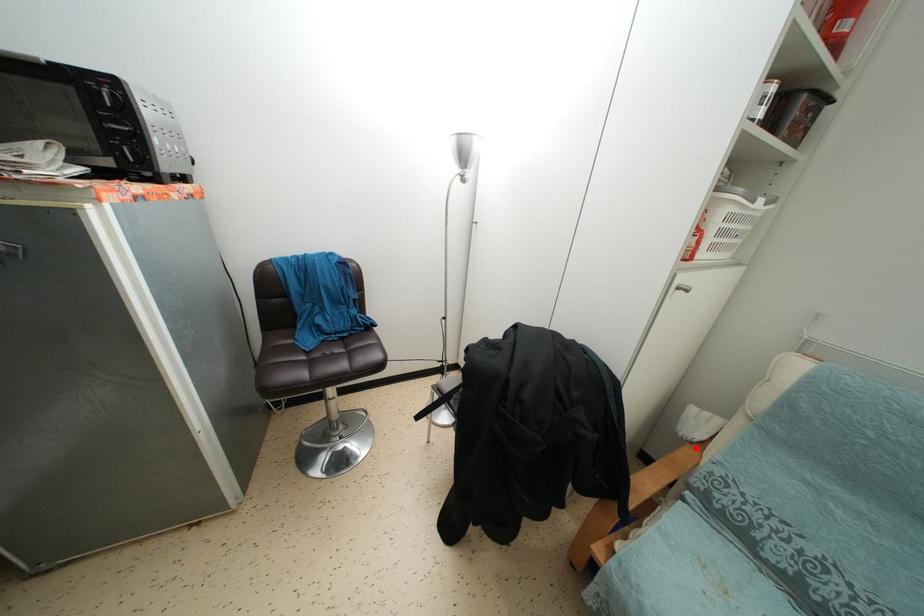
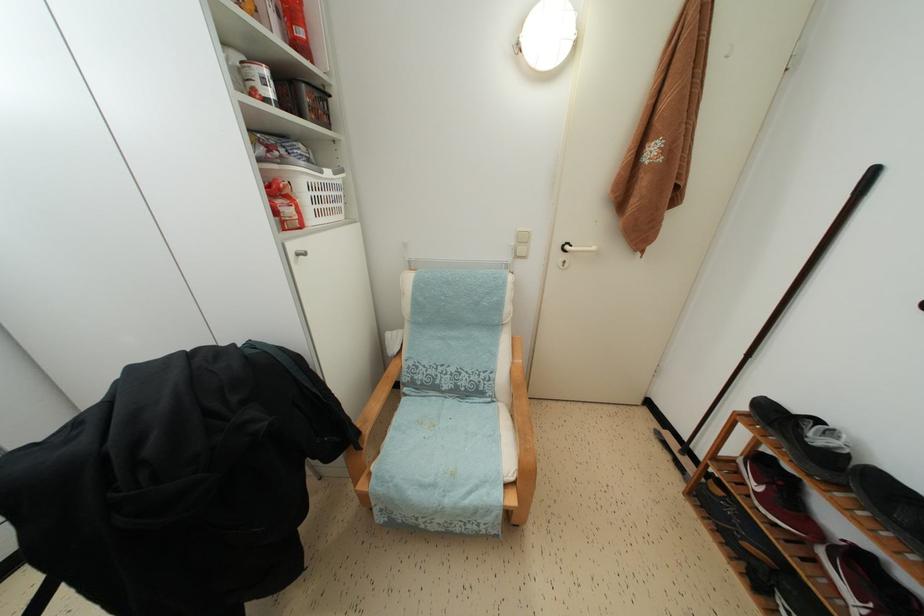
In the second image, find the point that corresponds to the highlighted location in the first image.

(399, 362)